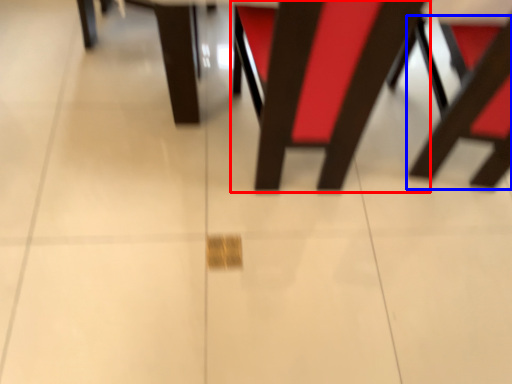
Question: Which object appears closest to the camera in this image, chair (highlighted by a red box) or chair (highlighted by a blue box)?

Choices:
 (A) chair
 (B) chair

Answer: (A)